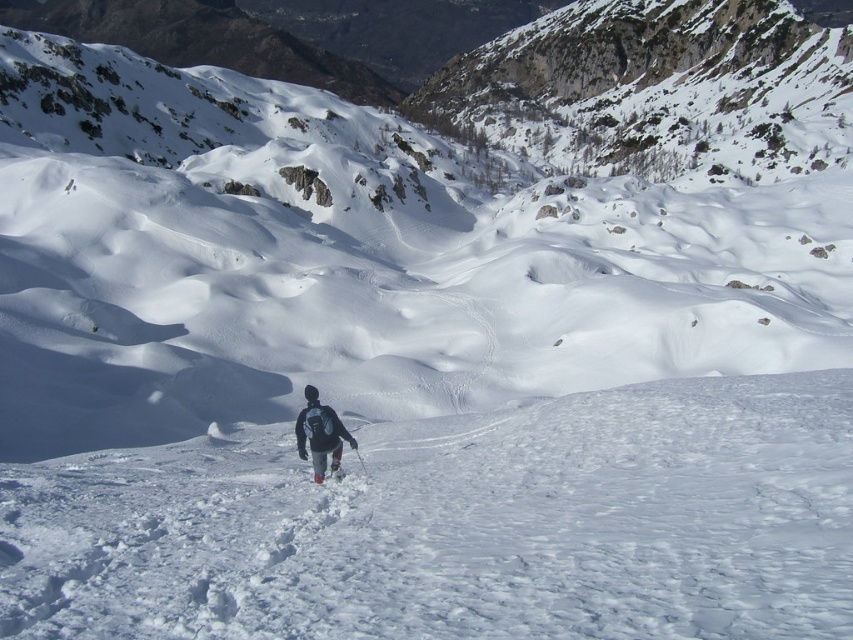
Does gray fabric backpack at center have a larger size compared to white matte ski at center?

Correct, gray fabric backpack at center is larger in size than white matte ski at center.

Find the location of a particular element. gray fabric backpack at center is located at coordinates (320, 435).